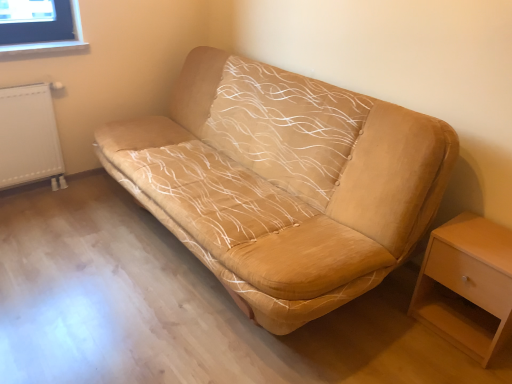
Question: From the image's perspective, does beige suede sofa at center appear lower than white textured radiator at left?

Choices:
 (A) yes
 (B) no

Answer: (A)

Question: Is beige suede sofa at center not inside white textured radiator at left?

Choices:
 (A) no
 (B) yes

Answer: (B)

Question: Does beige suede sofa at center have a lesser height compared to white textured radiator at left?

Choices:
 (A) no
 (B) yes

Answer: (A)

Question: Does beige suede sofa at center have a greater height compared to white textured radiator at left?

Choices:
 (A) yes
 (B) no

Answer: (A)

Question: Is beige suede sofa at center turned away from white textured radiator at left?

Choices:
 (A) yes
 (B) no

Answer: (B)

Question: Is beige suede sofa at center positioned behind white textured radiator at left?

Choices:
 (A) yes
 (B) no

Answer: (B)

Question: Is white textured radiator at left positioned in front of beige suede sofa at center?

Choices:
 (A) no
 (B) yes

Answer: (A)

Question: Is white textured radiator at left turned away from beige suede sofa at center?

Choices:
 (A) no
 (B) yes

Answer: (A)

Question: Is white textured radiator at left behind beige suede sofa at center?

Choices:
 (A) yes
 (B) no

Answer: (A)

Question: From a real-world perspective, is white textured radiator at left over beige suede sofa at center?

Choices:
 (A) no
 (B) yes

Answer: (A)

Question: Is white textured radiator at left located outside beige suede sofa at center?

Choices:
 (A) no
 (B) yes

Answer: (B)

Question: Is white textured radiator at left taller than beige suede sofa at center?

Choices:
 (A) no
 (B) yes

Answer: (A)

Question: Could you tell me if light wood/wooden nightstand at lower right is turned towards white textured radiator at left?

Choices:
 (A) no
 (B) yes

Answer: (A)